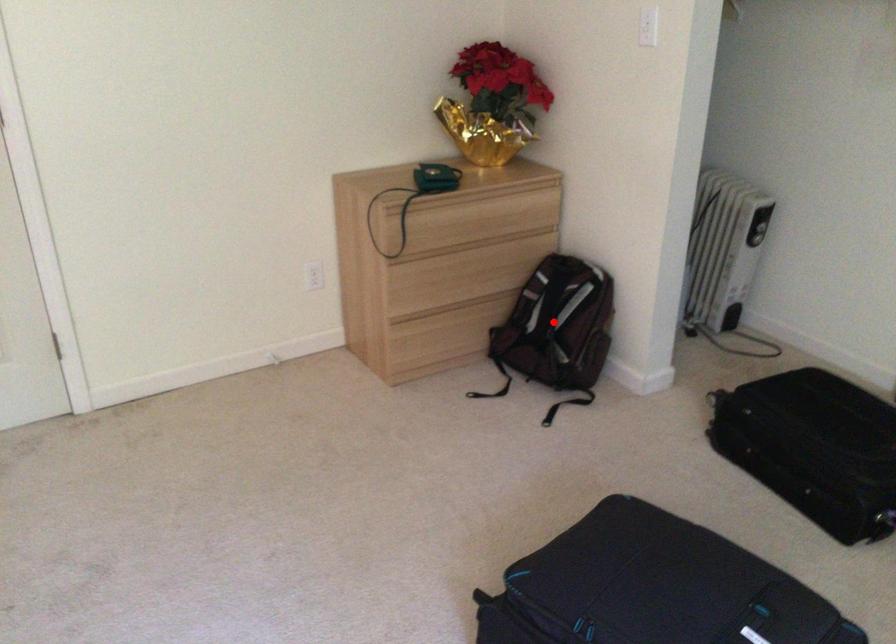
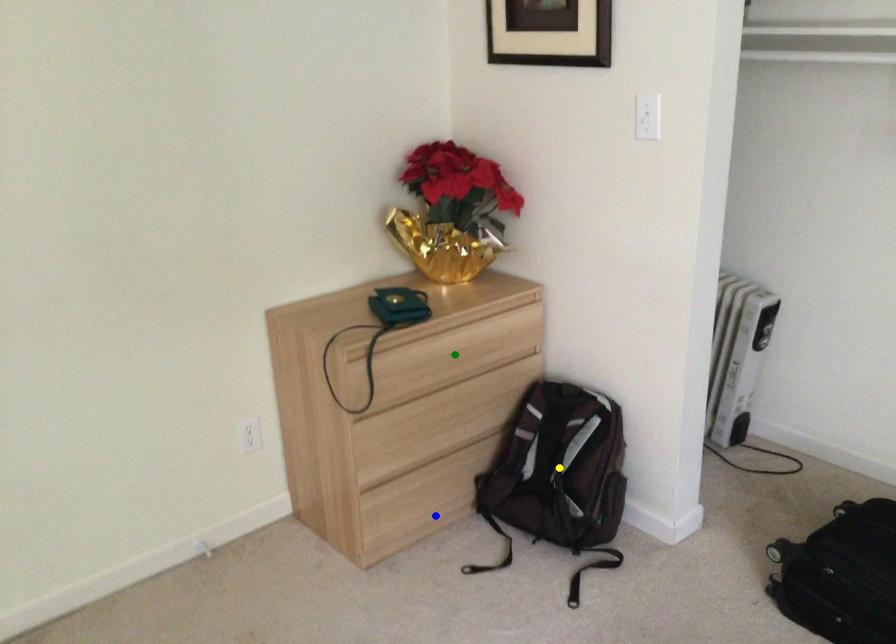
Question: I am providing you with two images of the same scene from different viewpoints. A red point is marked on the first image. You are given multiple points on the second image. In image 2, which mark is for the same physical point as the one in image 1?

Choices:
 (A) green point
 (B) blue point
 (C) yellow point

Answer: (C)